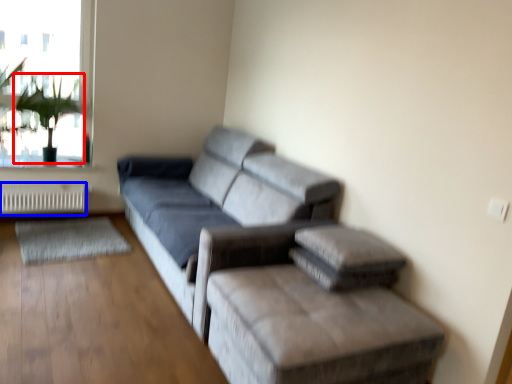
Question: Which of the following is the closest to the observer, plant (highlighted by a red box) or radiator (highlighted by a blue box)?

Choices:
 (A) plant
 (B) radiator

Answer: (A)